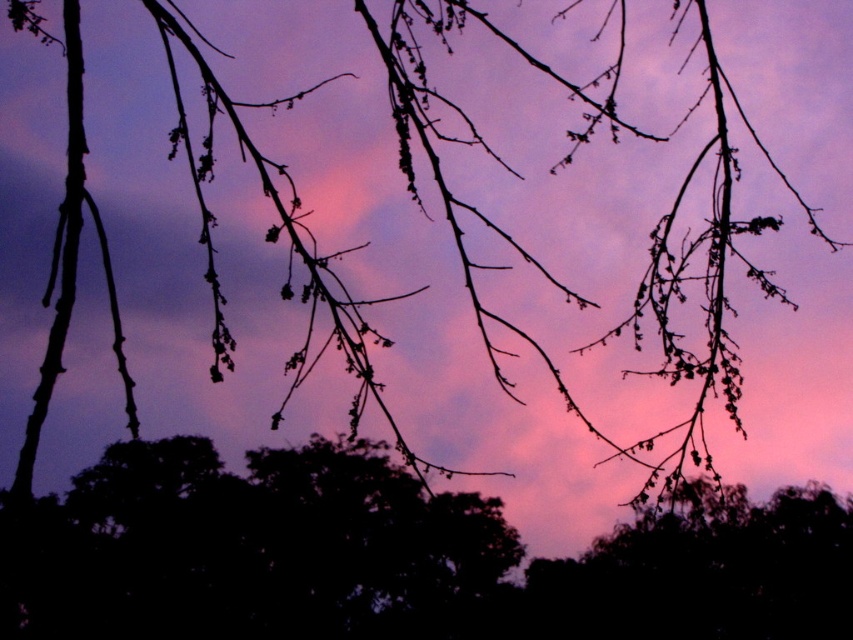
Can you confirm if silhouette branches at center is positioned below silvery branches at center?

No.

Based on the photo, is silhouette branches at center to the right of silvery branches at center from the viewer's perspective?

No, silhouette branches at center is not to the right of silvery branches at center.

Is point (276, 627) closer to viewer compared to point (637, 572)?

Yes.

Locate an element on the screen. silhouette branches at center is located at coordinates (398, 557).